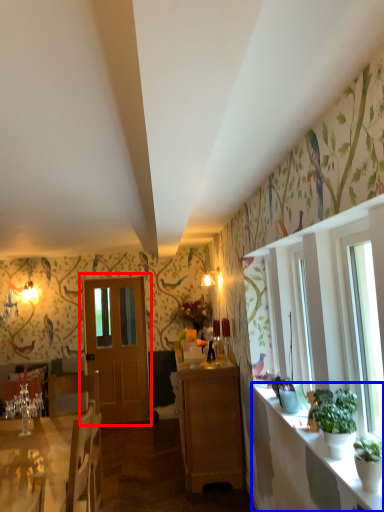
Question: Which of the following is the farthest to the observer, door (highlighted by a red box) or counter top (highlighted by a blue box)?

Choices:
 (A) door
 (B) counter top

Answer: (A)